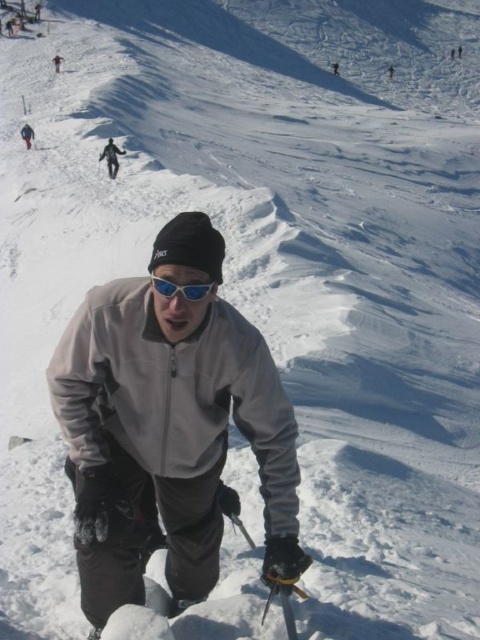
You are a photographer trying to capture the scene of the skier. You notice the blue reflective lens goggles at center and the gray matte jacket at upper center. Which object would appear larger in your photo?

The gray matte jacket at upper center appears larger than the blue reflective lens goggles at center because it is taller.

You are a drone operator trying to locate the gray fleece jacket at center on a crowded ski slope. The coordinates provided are in a normalized format between 0 and 1, where 0,0 is the bottom left corner and 1,1 is the top right corner. Given that the point is at (168, 426), which direction should you move the drone to reach the gray fleece jacket at center from the current position at 0.5, 0.5?

The point is at (168, 426) compared to the current position at 0.5, 0.5. Since the x coordinate is higher, the gray fleece jacket at center is to the right. The y coordinate is lower, so it is also below. Therefore, move the drone to the right and down to reach the gray fleece jacket at center.

You are a photographer trying to capture the skier in the scene. You notice the blue reflective lens goggles at center and the gray matte jacket at upper center. Which object is positioned more to the right side of the image?

The blue reflective lens goggles at center are positioned more to the right side of the image compared to the gray matte jacket at upper center.